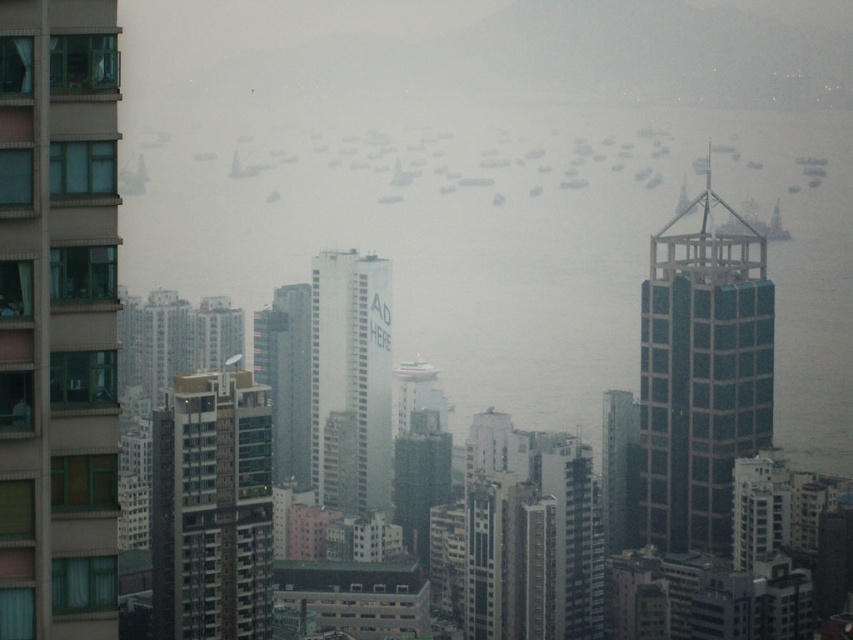
Which of these two, foggy water at center or metallic glass building at left, stands shorter?

metallic glass building at left

Is foggy water at center smaller than metallic glass building at left?

Incorrect, foggy water at center is not smaller in size than metallic glass building at left.

Describe the element at coordinates (514, 240) in the screenshot. This screenshot has height=640, width=853. I see `foggy water at center` at that location.

Where is `foggy water at center`? foggy water at center is located at coordinates coord(514,240).

Does white matte building at center have a greater width compared to white plastic boat at center?

Yes, white matte building at center is wider than white plastic boat at center.

Which is above, white matte building at center or white plastic boat at center?

white plastic boat at center is higher up.

The image size is (853, 640). In order to click on white matte building at center in this screenshot , I will do coord(352,362).

Between metallic glass building at left and glassy reflective skyscraper at center-right, which one has less height?

Standing shorter between the two is glassy reflective skyscraper at center-right.

Is point (206, 488) farther from camera compared to point (619, 497)?

Yes, it is behind point (619, 497).

This screenshot has width=853, height=640. I want to click on metallic glass building at left, so click(x=212, y=508).